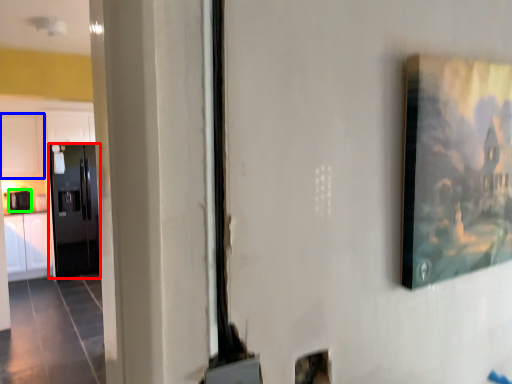
Question: Which object is positioned closest to door (highlighted by a red box)? Select from cabinetry (highlighted by a blue box) and appliance (highlighted by a green box).

Choices:
 (A) cabinetry
 (B) appliance

Answer: (A)